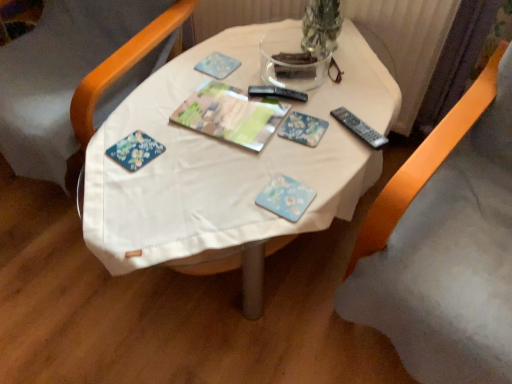
Find the location of a particular element. Image resolution: width=512 pixels, height=384 pixels. free space between blue floral coaster at center, the 2th paperback book viewed from the back, and floral-patterned paper at center, positioned as the first paperback book in back-to-front order is located at coordinates (296, 161).